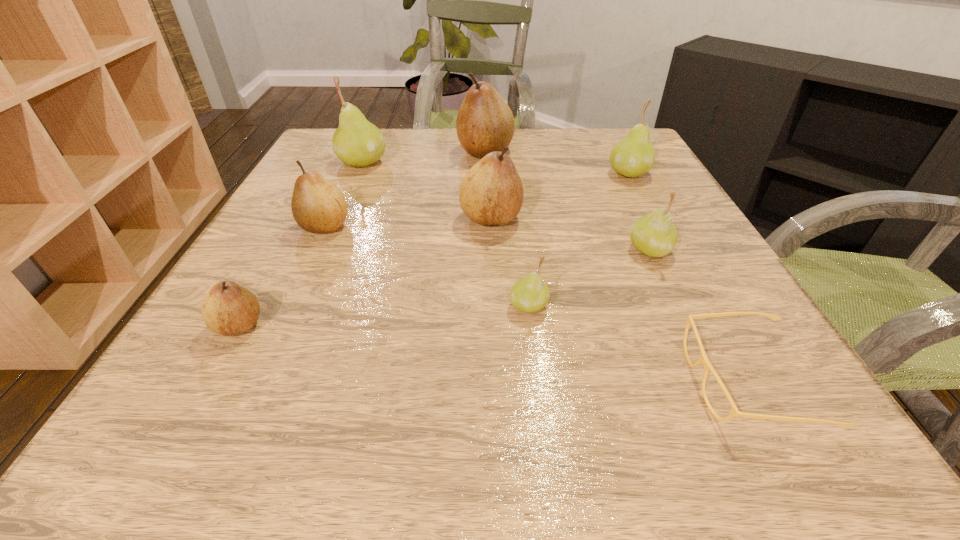
Find the location of a particular element. This screenshot has width=960, height=540. vacant position located 0.350m in front of the lenses of the beige spectacles is located at coordinates (431, 382).

You are a GUI agent. You are given a task and a screenshot of the screen. Output one action in this format:
    pyautogui.click(x=<x>, y=<y>)
    Task: Click on the blank area located in front of the lenses of the beige spectacles
    
    Given the screenshot: What is the action you would take?
    pyautogui.click(x=446, y=382)

Where is `object at the near edge`? This screenshot has height=540, width=960. object at the near edge is located at coordinates (703, 358).

Locate an element on the screen. This screenshot has width=960, height=540. spectacles located at the right edge is located at coordinates (703, 358).

Where is `object that is at the far left corner`? The image size is (960, 540). object that is at the far left corner is located at coordinates (357, 142).

Where is `object that is at the far right corner`? This screenshot has width=960, height=540. object that is at the far right corner is located at coordinates (633, 156).

I want to click on object present at the near right corner, so click(x=703, y=358).

Where is `vacant area at the far edge`? vacant area at the far edge is located at coordinates (572, 132).

Locate an element on the screen. vacant position at the near edge of the desktop is located at coordinates (457, 392).

Where is `free space at the left edge of the desktop`? This screenshot has width=960, height=540. free space at the left edge of the desktop is located at coordinates (278, 310).